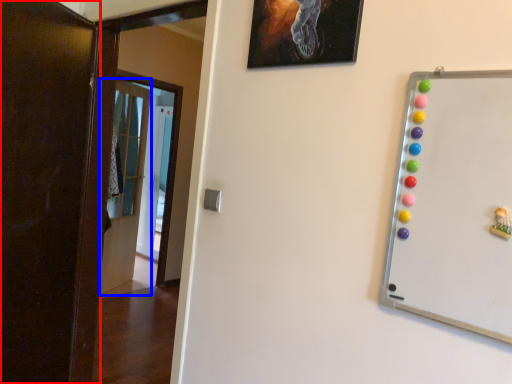
Question: Among these objects, which one is farthest to the camera, door (highlighted by a red box) or door (highlighted by a blue box)?

Choices:
 (A) door
 (B) door

Answer: (B)